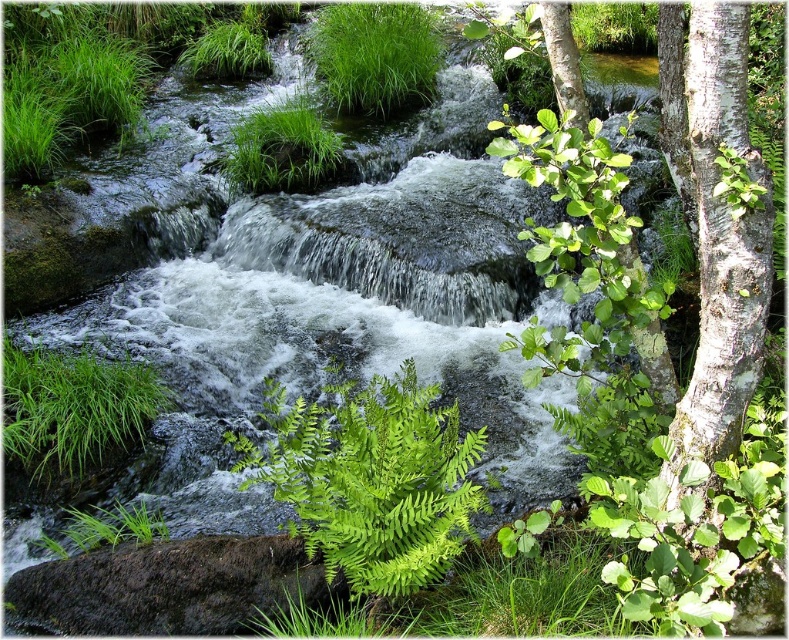
Question: Which is farther from the green leafy fern at center?

Choices:
 (A) green leafy grass at upper center
 (B) green leafy grass at lower left

Answer: (A)

Question: Does green leafy fern at center have a greater width compared to white smooth bark tree at right?

Choices:
 (A) yes
 (B) no

Answer: (A)

Question: Does white smooth bark tree at right have a lesser width compared to green leafy grass at upper center?

Choices:
 (A) no
 (B) yes

Answer: (B)

Question: Is green leafy fern at upper right positioned behind green leafy grass at center?

Choices:
 (A) no
 (B) yes

Answer: (A)

Question: Which object is closer to the camera taking this photo?

Choices:
 (A) green leafy grass at lower left
 (B) green leafy grass at center

Answer: (A)

Question: Which point is farther to the camera?

Choices:
 (A) (589, 268)
 (B) (4, 419)
 (C) (703, 301)

Answer: (B)